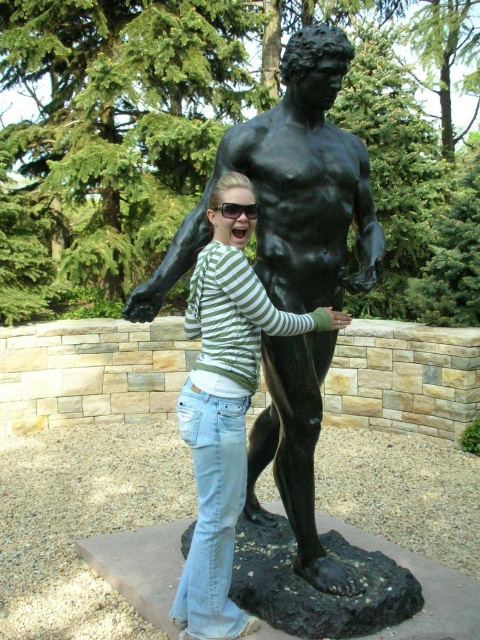
You are standing in front of the statue and see the point at coordinates (225,417). According to the image, where is this point located?

The point at coordinates (225,417) is located on the green striped shirt at center.

You are standing in a park and want to take a photo of yourself with the black matte statue at center. If you need to be 10 feet away from the statue to fit both of you in the frame, can you step back to achieve this?

The black matte statue at center is currently 9.30 feet away from the camera, so stepping back slightly would allow you to reach the desired 10 feet distance to fit both in the frame.

You are an art student who wants to create a scale model of the black matte statue at center and the black plastic goggles at center. Which object should you make first if you want to start with the larger one?

The black matte statue at center is bigger than the black plastic goggles at center, so you should start with the black matte statue at center first.